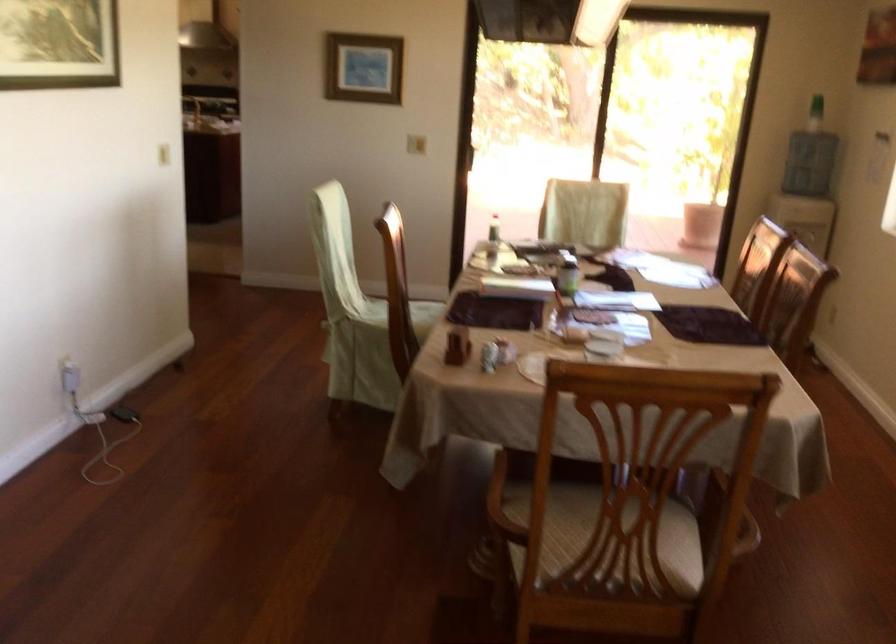
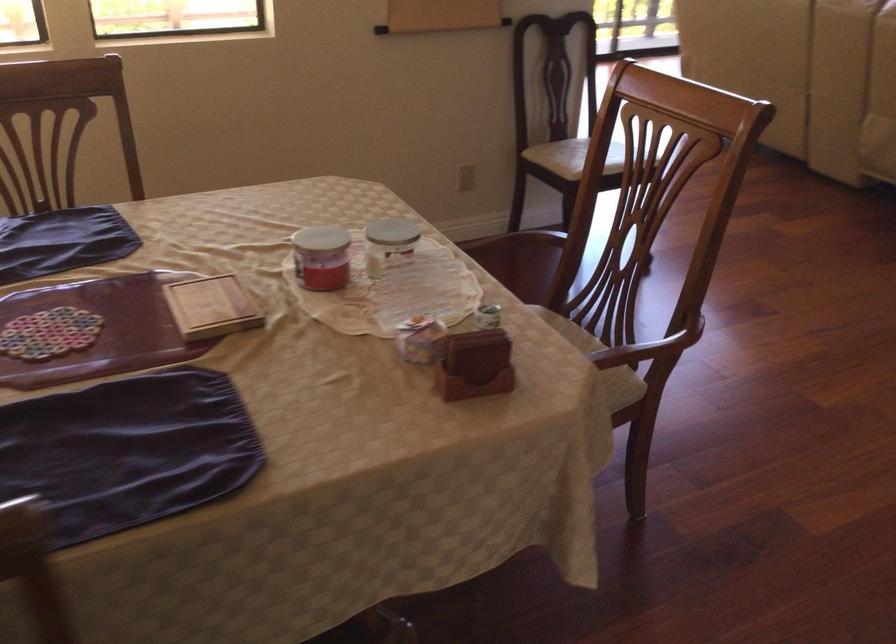
Question: I am providing you with two images of the same scene from different viewpoints. After the viewpoint changes to image2, which objects are now occluded?

Choices:
 (A) small wooden book
 (B) chair sitting surface
 (C) red candle jar
 (D) orange chair sitting surface

Answer: (B)